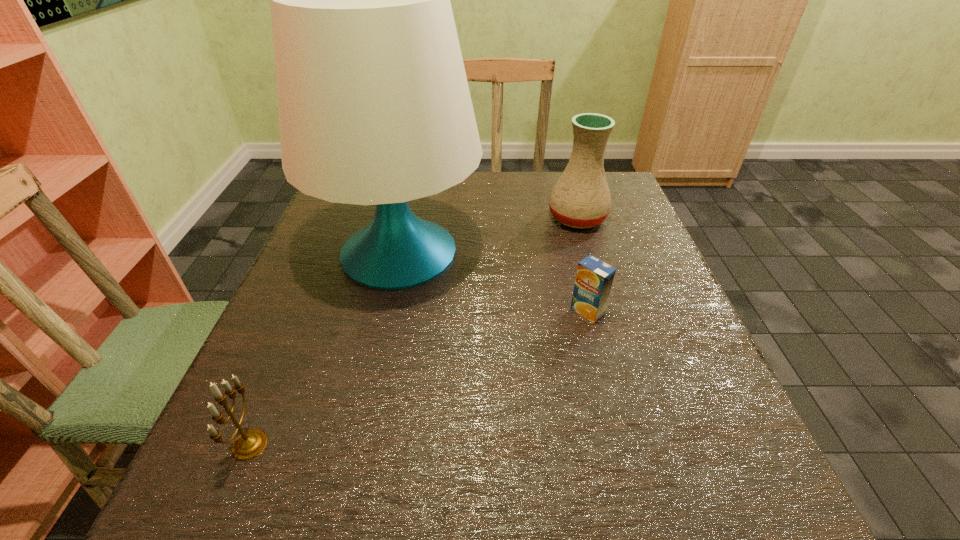
Find the location of a particular element. This screenshot has height=540, width=960. vacant space that's between the table lamp and the second tallest object is located at coordinates (489, 234).

Identify the location of vacant space that's between the orange_juice and the tallest object. The image size is (960, 540). (493, 281).

The height and width of the screenshot is (540, 960). I want to click on free spot between the candelabrum and the pottery, so click(x=414, y=331).

Locate which object is the second closest to the table lamp. Please provide its 2D coordinates. Your answer should be formatted as a tuple, i.e. [(x, y)], where the tuple contains the x and y coordinates of a point satisfying the conditions above.

[(594, 278)]

I want to click on object that ranks as the second closest to the pottery, so click(594, 278).

Locate an element on the screen. free location that satisfies the following two spatial constraints: 1. on the front-facing side of the orange_juice; 2. on the left side of the tallest object is located at coordinates (386, 311).

At what (x,y) coordinates should I click in order to perform the action: click on free space that satisfies the following two spatial constraints: 1. on the front-facing side of the table lamp; 2. on the front side of the nearest object. Please return your answer as a coordinate pair (x, y). Looking at the image, I should click on (355, 445).

Image resolution: width=960 pixels, height=540 pixels. Find the location of `vacant region that satisfies the following two spatial constraints: 1. on the front-facing side of the tallest object; 2. on the front side of the third tallest object`. vacant region that satisfies the following two spatial constraints: 1. on the front-facing side of the tallest object; 2. on the front side of the third tallest object is located at coordinates (355, 445).

Where is `free space that satisfies the following two spatial constraints: 1. on the front-facing side of the tallest object; 2. on the left side of the orange_juice`? free space that satisfies the following two spatial constraints: 1. on the front-facing side of the tallest object; 2. on the left side of the orange_juice is located at coordinates (386, 311).

You are a GUI agent. You are given a task and a screenshot of the screen. Output one action in this format:
    pyautogui.click(x=<x>, y=<y>)
    Task: Click on the free space that satisfies the following two spatial constraints: 1. on the front-facing side of the tallest object; 2. on the right side of the orange_juice
    
    Given the screenshot: What is the action you would take?
    pyautogui.click(x=386, y=311)